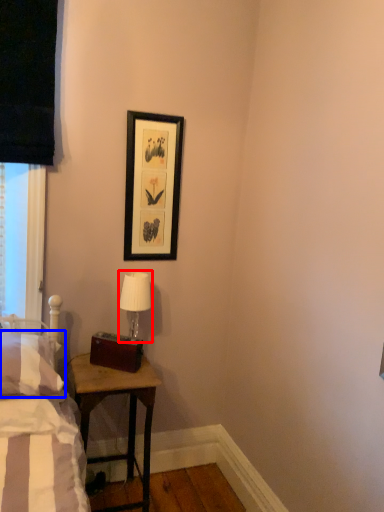
Question: Which of the following is the farthest to the observer, table lamp (highlighted by a red box) or pillow (highlighted by a blue box)?

Choices:
 (A) table lamp
 (B) pillow

Answer: (A)